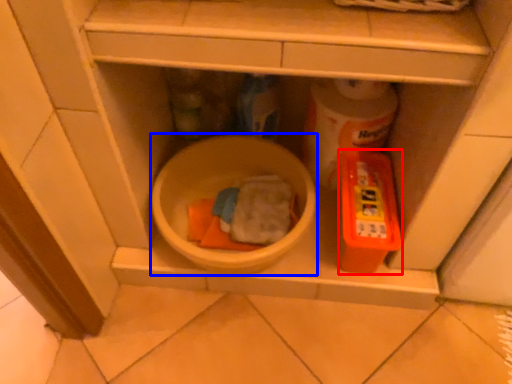
Question: Which of the following is the farthest to the observer, toy (highlighted by a red box) or mixing bowl (highlighted by a blue box)?

Choices:
 (A) toy
 (B) mixing bowl

Answer: (A)